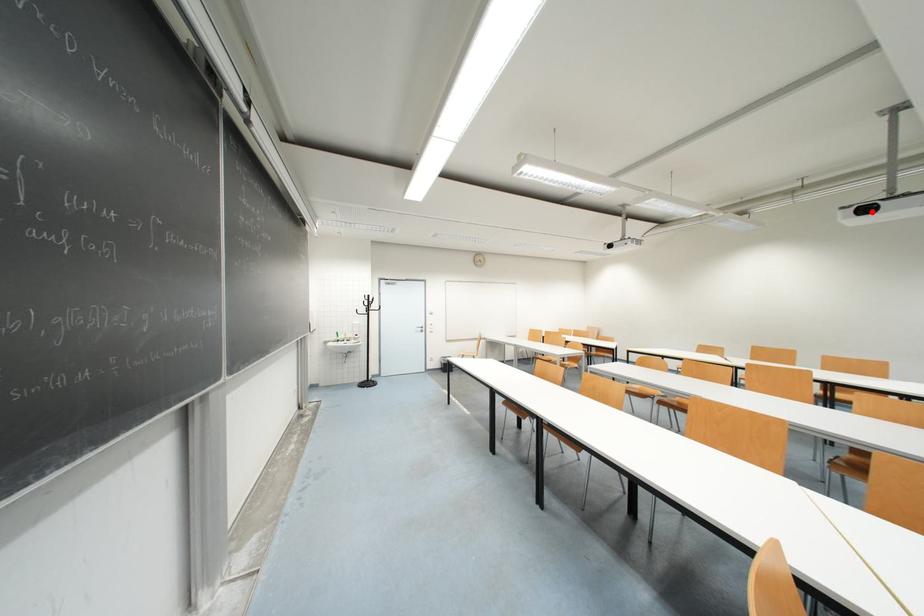
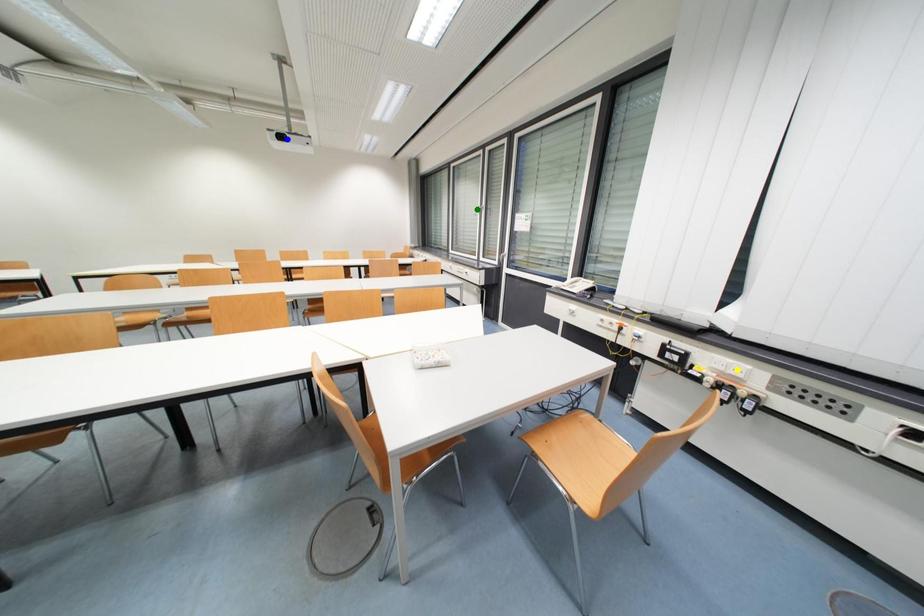
Question: I am providing you with two images of the same scene from different viewpoints. A red point is marked on the first image. You are given multiple points on the second image. Which spot in image 2 lines up with the point in image 1?

Choices:
 (A) blue point
 (B) yellow point
 (C) green point

Answer: (A)